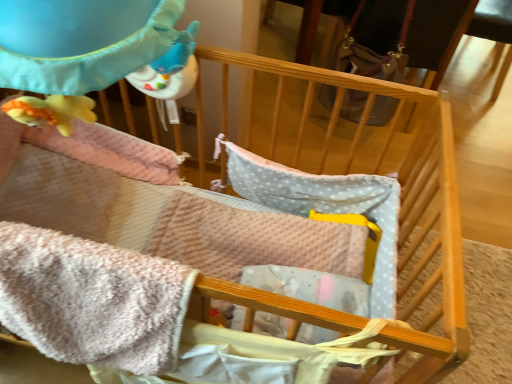
Question: Can you confirm if pink plush blanket at lower left is bigger than leather-like brown bag at upper right?

Choices:
 (A) no
 (B) yes

Answer: (A)

Question: Considering the relative sizes of pink plush blanket at lower left and leather-like brown bag at upper right in the image provided, is pink plush blanket at lower left smaller than leather-like brown bag at upper right?

Choices:
 (A) no
 (B) yes

Answer: (B)

Question: Can you confirm if pink plush blanket at lower left is positioned to the left of leather-like brown bag at upper right?

Choices:
 (A) no
 (B) yes

Answer: (B)

Question: Does pink plush blanket at lower left lie in front of leather-like brown bag at upper right?

Choices:
 (A) no
 (B) yes

Answer: (B)

Question: Does pink plush blanket at lower left have a lesser width compared to leather-like brown bag at upper right?

Choices:
 (A) no
 (B) yes

Answer: (B)

Question: Is the depth of pink plush blanket at lower left greater than that of leather-like brown bag at upper right?

Choices:
 (A) yes
 (B) no

Answer: (B)

Question: Can you confirm if leather-like brown bag at upper right is positioned to the left of pink plush blanket at lower left?

Choices:
 (A) yes
 (B) no

Answer: (B)

Question: From the image's perspective, is leather-like brown bag at upper right located above pink plush blanket at lower left?

Choices:
 (A) no
 (B) yes

Answer: (B)

Question: Is leather-like brown bag at upper right not inside pink plush blanket at lower left?

Choices:
 (A) no
 (B) yes

Answer: (B)

Question: From a real-world perspective, is leather-like brown bag at upper right located higher than pink plush blanket at lower left?

Choices:
 (A) no
 (B) yes

Answer: (A)

Question: Can you confirm if leather-like brown bag at upper right is taller than pink plush blanket at lower left?

Choices:
 (A) no
 (B) yes

Answer: (B)

Question: Can you confirm if leather-like brown bag at upper right is thinner than pink plush blanket at lower left?

Choices:
 (A) yes
 (B) no

Answer: (B)

Question: Considering the positions of leather-like brown bag at upper right and pink plush blanket at lower left in the image, is leather-like brown bag at upper right taller or shorter than pink plush blanket at lower left?

Choices:
 (A) tall
 (B) short

Answer: (A)